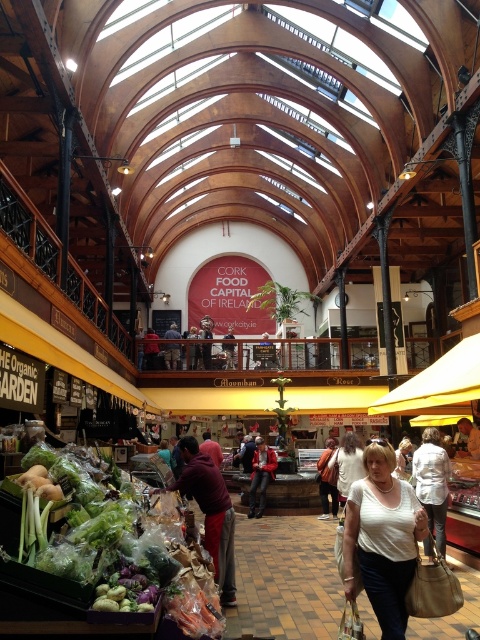
You are a customer at the Cork Food Market and need to decide between buying the maroon sweater at center and the white fabric shirt at center. Which item is located more to the left side?

The maroon sweater at center is positioned on the left side of the white fabric shirt at center, so it is more to the left.

You are a customer in the Cork Food Market and need to pick up both the green leafy vegetables at lower left and the maroon sweater at center. If you start at the entrance, which item should you walk towards first to minimize the total distance traveled?

The distance between the green leafy vegetables at lower left and the maroon sweater at center is 26.30 feet. To minimize the total distance traveled, you should first go to whichever is closer to the entrance. However, without knowing the entrance location, it is impossible to determine the optimal path.